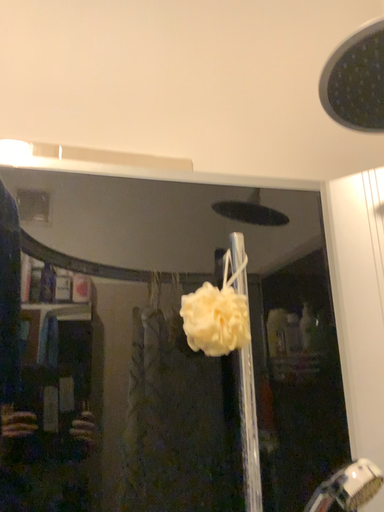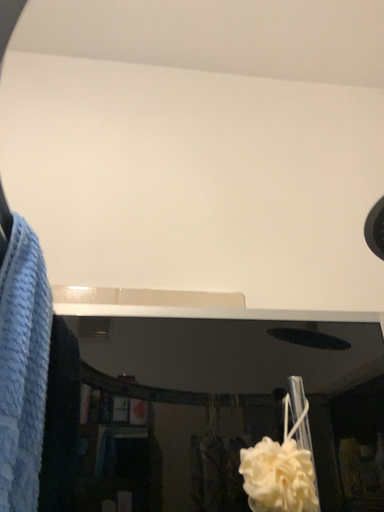
Question: How did the camera likely rotate when shooting the video?

Choices:
 (A) rotated downward
 (B) rotated upward

Answer: (B)